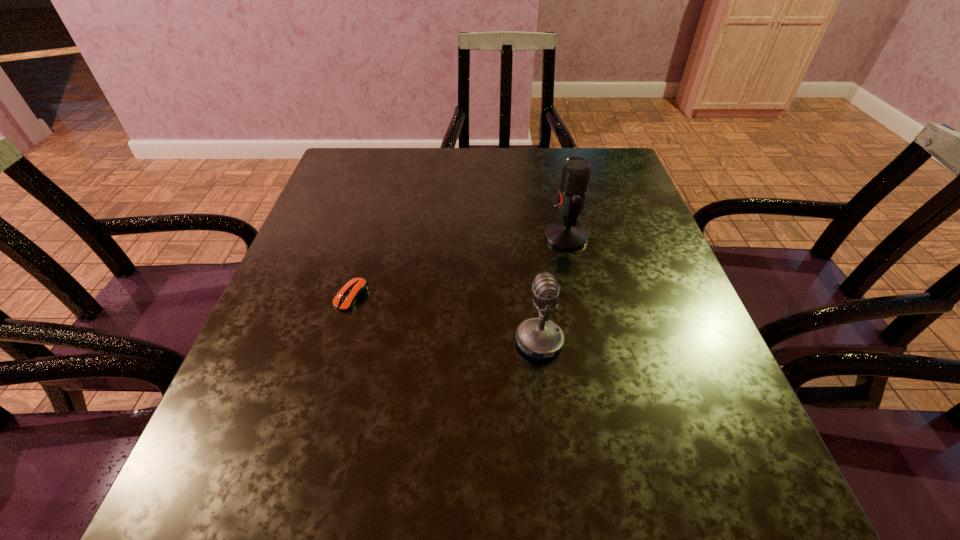
I want to click on free space located on the front-facing side of the nearer microphone, so click(x=460, y=342).

The height and width of the screenshot is (540, 960). I want to click on free space located 0.090m on the right of the shortest object, so click(x=413, y=296).

You are a GUI agent. You are given a task and a screenshot of the screen. Output one action in this format:
    pyautogui.click(x=<x>, y=<y>)
    Task: Click on the object located in the left edge section of the desktop
    Image resolution: width=960 pixels, height=540 pixels.
    Given the screenshot: What is the action you would take?
    pyautogui.click(x=356, y=288)

I want to click on object that is at the right edge, so click(x=568, y=235).

Locate an element on the screen. Image resolution: width=960 pixels, height=540 pixels. free space at the far edge of the desktop is located at coordinates (436, 149).

Where is `free space at the left edge`? The width and height of the screenshot is (960, 540). free space at the left edge is located at coordinates (262, 441).

Image resolution: width=960 pixels, height=540 pixels. What are the coordinates of `blank area at the right edge` in the screenshot? It's located at (602, 239).

The height and width of the screenshot is (540, 960). In the image, there is a desktop. Find the location of `free space at the far left corner`. free space at the far left corner is located at coordinates click(382, 186).

Where is `free space at the near left corner of the desktop`? The width and height of the screenshot is (960, 540). free space at the near left corner of the desktop is located at coordinates (182, 506).

Identify the location of free spot at the far right corner of the desktop. This screenshot has height=540, width=960. (624, 190).